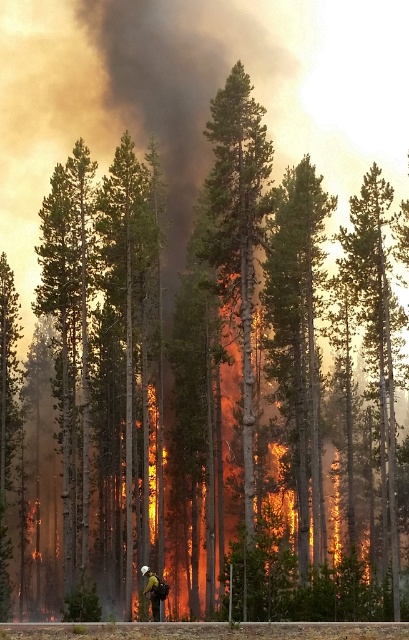
Is green smooth bark tree at center taller than hard hat helmet at center?

Correct, green smooth bark tree at center is much taller as hard hat helmet at center.

Does green smooth bark tree at center have a lesser height compared to hard hat helmet at center?

No, green smooth bark tree at center is not shorter than hard hat helmet at center.

Where is `green smooth bark tree at center`? This screenshot has width=409, height=640. green smooth bark tree at center is located at coordinates (238, 228).

Which is in front, point (298, 467) or point (386, 275)?

Point (386, 275) is in front.

Who is taller, green rough bark tree at center or green smooth tree at right?

Standing taller between the two is green rough bark tree at center.

Does point (296, 189) come closer to viewer compared to point (395, 608)?

No.

Locate an element on the screen. This screenshot has width=409, height=640. green rough bark tree at center is located at coordinates (298, 337).

Consider the image. Who is more forward, (244, 346) or (391, 538)?

Point (244, 346) is in front.

Is green smooth bark tree at center wider than green smooth tree at right?

No, green smooth bark tree at center is not wider than green smooth tree at right.

Describe the element at coordinates (238, 228) in the screenshot. This screenshot has width=409, height=640. I see `green smooth bark tree at center` at that location.

Where is `green smooth bark tree at center`? green smooth bark tree at center is located at coordinates (238, 228).